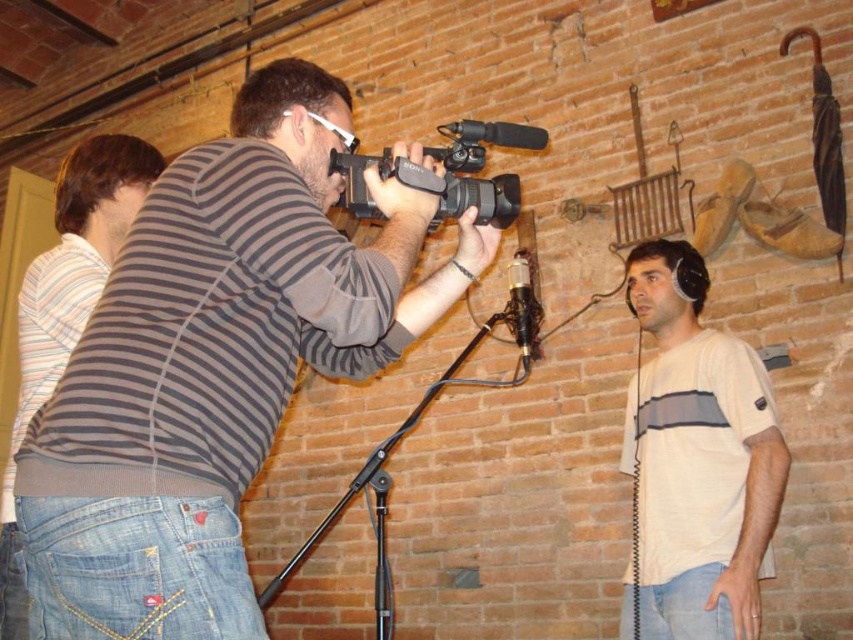
You are standing at the point marked by coordinates point (x=144, y=204). You want to film a scene using the Sony camcorder. Can you reach the camera from your current position without moving your feet?

The distance between point (x=144, y=204) and the camera is 4.69 feet. Since the distance is greater than the typical arm length of a person, you cannot reach the camera from your current position without moving your feet.

You are a photographer setting up equipment in the scene. You need to place a 36 inch wide banner between the denim jeans at left and the black metal tripod at center. Will there be enough space?

The denim jeans at left and black metal tripod at center are 37.20 inches apart. Since the banner is 36 inches wide, there is enough space to place it between them as the distance is slightly larger than the banner width.